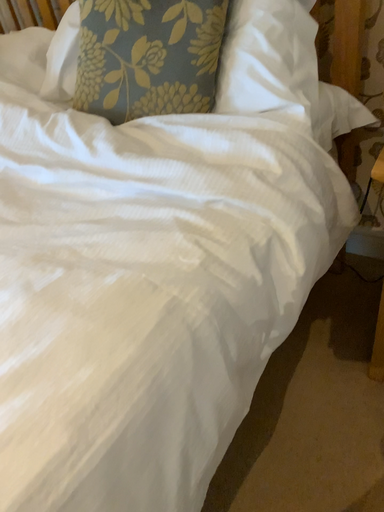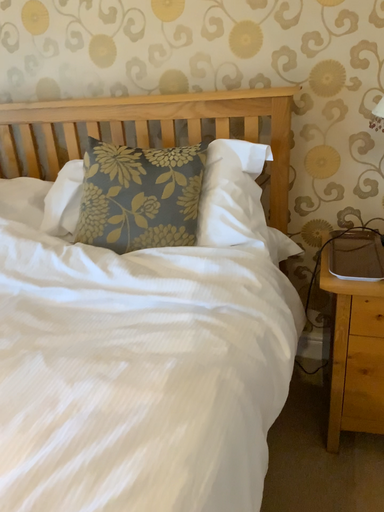
Question: How did the camera likely rotate when shooting the video?

Choices:
 (A) rotated downward
 (B) rotated upward

Answer: (B)